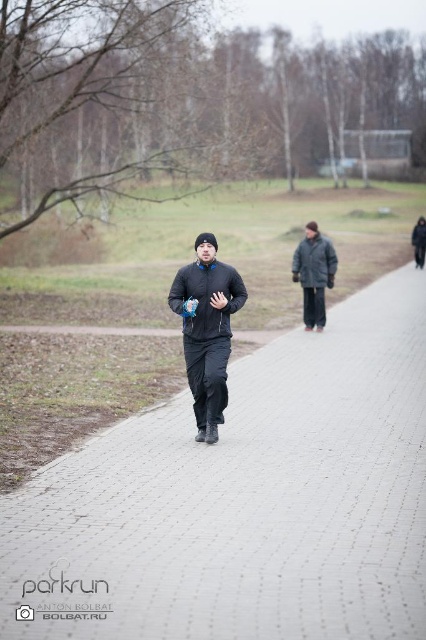
Question: Based on their relative distances, which object is farther from the matte black sweatshirt at center?

Choices:
 (A) gray brick pavement at center
 (B) black matte jacket at center
 (C) matte black jacket at center

Answer: (B)

Question: Is matte black jacket at center further to camera compared to dark gray woolen jacket at center?

Choices:
 (A) no
 (B) yes

Answer: (A)

Question: Which object appears closest to the camera in this image?

Choices:
 (A) gray brick pavement at center
 (B) dark gray woolen jacket at center
 (C) black matte jacket at center

Answer: (A)

Question: Which point is closer to the camera taking this photo?

Choices:
 (A) (385, 380)
 (B) (235, 269)
 (C) (330, 273)

Answer: (B)

Question: Does matte black sweatshirt at center have a larger size compared to black matte jacket at center?

Choices:
 (A) no
 (B) yes

Answer: (A)

Question: Observing the image, what is the correct spatial positioning of gray brick pavement at center in reference to matte black sweatshirt at center?

Choices:
 (A) above
 (B) below

Answer: (B)